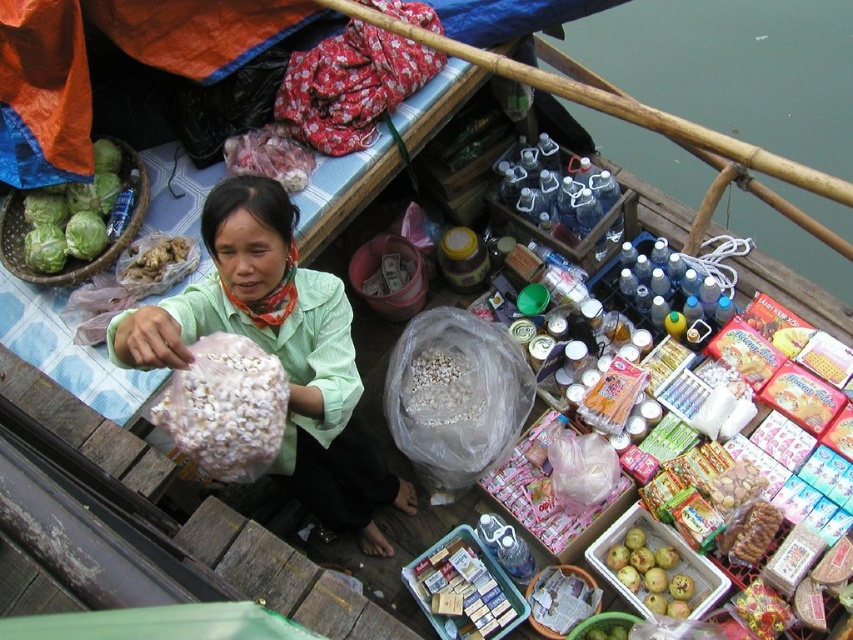
Question: Is matte green blouse at center wider than green leafy cabbage at left?

Choices:
 (A) yes
 (B) no

Answer: (A)

Question: Can you confirm if green leafy cabbage at left is positioned to the left of brown crumbly ginger at center?

Choices:
 (A) no
 (B) yes

Answer: (B)

Question: Which point is closer to the camera?

Choices:
 (A) (44, 259)
 (B) (161, 240)

Answer: (A)

Question: Which object is the farthest from the green matte apples at lower right?

Choices:
 (A) white matte popcorn at center
 (B) white matte dried beans at center
 (C) brown crumbly ginger at center
 (D) transparent plastic bottles at center

Answer: (D)

Question: Estimate the real-world distances between objects in this image. Which object is farther from the white matte popcorn at center?

Choices:
 (A) matte green blouse at center
 (B) brown crumbly ginger at center
 (C) green leafy cabbage at left

Answer: (C)

Question: In this image, where is green leafy cabbage at left located relative to brown crumbly ginger at center?

Choices:
 (A) below
 (B) above

Answer: (B)